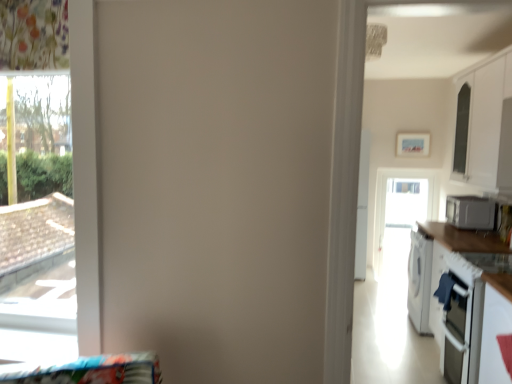
Locate an element on the screen. satin silver microwave at right is located at coordinates (470, 212).

What do you see at coordinates (470, 301) in the screenshot?
I see `white glossy countertop at right` at bounding box center [470, 301].

The height and width of the screenshot is (384, 512). I want to click on satin silver microwave at right, so click(x=470, y=212).

Is white glossy cabinet at upper right bigger or smaller than satin silver microwave at right?

Clearly, white glossy cabinet at upper right is larger in size than satin silver microwave at right.

Is white glossy cabinet at upper right located outside satin silver microwave at right?

Absolutely, white glossy cabinet at upper right is external to satin silver microwave at right.

Are white glossy cabinet at upper right and satin silver microwave at right beside each other?

No, white glossy cabinet at upper right is not making contact with satin silver microwave at right.

Between white glossy cabinet at upper right and satin silver microwave at right, which one appears on the left side from the viewer's perspective?

Positioned to the left is white glossy cabinet at upper right.

What's the angular difference between satin silver microwave at right and white glossy cabinet at upper right's facing directions?

0.000305 degrees.

Is satin silver microwave at right wider or thinner than white glossy cabinet at upper right?

In the image, satin silver microwave at right appears to be wider than white glossy cabinet at upper right.

Is satin silver microwave at right in front of white glossy cabinet at upper right?

No, the depth of satin silver microwave at right is greater than that of white glossy cabinet at upper right.

Between transparent glass window at left and transparent glass screen door at center, which one appears on the left side from the viewer's perspective?

transparent glass window at left is more to the left.

Is transparent glass window at left further to the viewer compared to transparent glass screen door at center?

Answer: No, it is in front of transparent glass screen door at center.

Which is closer to the camera, (12, 143) or (411, 186)?

Positioned in front is point (12, 143).

Where is `window on the left of transparent glass screen door at center`? The height and width of the screenshot is (384, 512). window on the left of transparent glass screen door at center is located at coordinates (37, 217).

Is white glossy countertop at right next to transparent glass window at left and touching it?

No, white glossy countertop at right is not making contact with transparent glass window at left.

Is point (488, 368) positioned before point (10, 281)?

No.

How much distance is there between white glossy countertop at right and transparent glass window at left?

white glossy countertop at right is 7.85 feet from transparent glass window at left.

Which of these two, white glossy countertop at right or transparent glass window at left, stands taller?

transparent glass window at left is taller.

Considering the sizes of objects transparent glass screen door at center and satin silver microwave at right in the image provided, who is bigger, transparent glass screen door at center or satin silver microwave at right?

With larger size is transparent glass screen door at center.

From the image's perspective, between transparent glass screen door at center and satin silver microwave at right, who is located below?

From the image's view, transparent glass screen door at center is below.

From a real-world perspective, is transparent glass screen door at center on satin silver microwave at right?

Incorrect, from a real-world perspective, transparent glass screen door at center is lower than satin silver microwave at right.

Which of these two, transparent glass screen door at center or satin silver microwave at right, stands taller?

With more height is transparent glass screen door at center.

From a real-world perspective, between transparent glass screen door at center and transparent glass window at left, who is vertically lower?

transparent glass screen door at center, from a real-world perspective.

Considering the sizes of transparent glass screen door at center and transparent glass window at left in the image, is transparent glass screen door at center bigger or smaller than transparent glass window at left?

Considering their sizes, transparent glass screen door at center takes up less space than transparent glass window at left.

How many degrees apart are the facing directions of transparent glass screen door at center and transparent glass window at left?

0.000604 degrees separate the facing orientations of transparent glass screen door at center and transparent glass window at left.

The width and height of the screenshot is (512, 384). What are the coordinates of `screen door on the right side of transparent glass window at left` in the screenshot? It's located at (402, 202).

You are a GUI agent. You are given a task and a screenshot of the screen. Output one action in this format:
    pyautogui.click(x=<x>, y=<y>)
    Task: Click on the cabinetry positioned vertically above the transparent glass screen door at center (from a real-world perspective)
    The width and height of the screenshot is (512, 384).
    Given the screenshot: What is the action you would take?
    pyautogui.click(x=485, y=126)

From a real-world perspective, which object rests below the other?

From a 3D spatial view, transparent glass screen door at center is below.

From the image's perspective, between white glossy cabinet at upper right and transparent glass screen door at center, which one is located above?

white glossy cabinet at upper right is shown above in the image.

Between white glossy cabinet at upper right and transparent glass screen door at center, which one has less height?

white glossy cabinet at upper right.

Where is `cabinetry above the satin silver microwave at right (from the image's perspective)`? The height and width of the screenshot is (384, 512). cabinetry above the satin silver microwave at right (from the image's perspective) is located at coordinates (485, 126).

The height and width of the screenshot is (384, 512). I want to click on cabinetry on the left of satin silver microwave at right, so click(485, 126).

Looking at the image, which one is located further to transparent glass window at left, white glossy cabinet at upper right or satin silver microwave at right?

satin silver microwave at right.

When comparing their distances from satin silver microwave at right, does transparent glass window at left or transparent glass screen door at center seem closer?

Among the two, transparent glass screen door at center is located nearer to satin silver microwave at right.

When comparing their distances from white glossy cabinet at upper right, does white glossy countertop at right or transparent glass window at left seem further?

transparent glass window at left.

Estimate the real-world distances between objects in this image. Which object is closer to transparent glass screen door at center, transparent glass window at left or white glossy cabinet at upper right?

white glossy cabinet at upper right.

Based on their spatial positions, is white glossy countertop at right or transparent glass window at left closer to transparent glass screen door at center?

white glossy countertop at right is positioned closer to the anchor transparent glass screen door at center.

When comparing their distances from satin silver microwave at right, does white glossy countertop at right or white glossy cabinet at upper right seem further?

The object further to satin silver microwave at right is white glossy countertop at right.

Based on the photo, which object lies nearer to the anchor point transparent glass window at left, white glossy countertop at right or white glossy cabinet at upper right?

white glossy countertop at right is closer to transparent glass window at left.

Which object lies further to the anchor point transparent glass window at left, transparent glass screen door at center or satin silver microwave at right?

transparent glass screen door at center is positioned further to the anchor transparent glass window at left.

You are a GUI agent. You are given a task and a screenshot of the screen. Output one action in this format:
    pyautogui.click(x=<x>, y=<y>)
    Task: Click on the cabinetry positioned between white glossy countertop at right and transparent glass screen door at center from near to far
    
    Given the screenshot: What is the action you would take?
    [485, 126]

At what (x,y) coordinates should I click in order to perform the action: click on counter top between transparent glass window at left and transparent glass screen door at center along the z-axis. Please return your answer as a coordinate pair (x, y). The width and height of the screenshot is (512, 384). Looking at the image, I should click on [x=470, y=301].

Locate an element on the screen. appliance between white glossy countertop at right and transparent glass screen door at center in the front-back direction is located at coordinates (470, 212).

Where is `appliance positioned between white glossy cabinet at upper right and transparent glass screen door at center from near to far`? The height and width of the screenshot is (384, 512). appliance positioned between white glossy cabinet at upper right and transparent glass screen door at center from near to far is located at coordinates (470, 212).